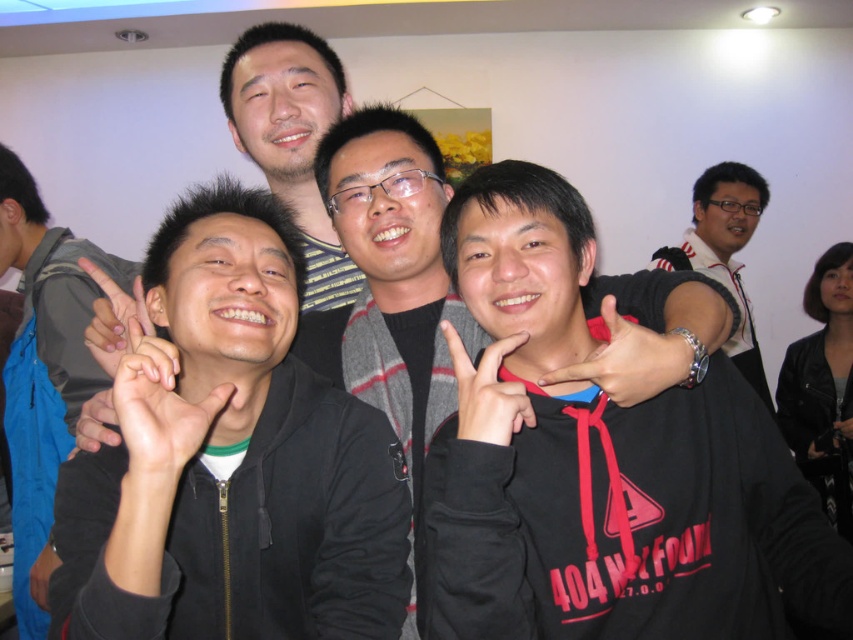
Question: Which of the following is the closest to the observer?

Choices:
 (A) (242, 440)
 (B) (4, 221)

Answer: (A)

Question: Which of the following is the closest to the observer?

Choices:
 (A) black matte hoodie at center
 (B) matte black ear at lower left
 (C) black matte hand at center

Answer: (C)

Question: Among these objects, which one is farthest from the camera?

Choices:
 (A) blue matte phone at center
 (B) black matte hand at lower left
 (C) black matte hoodie at center

Answer: (B)

Question: Does matte black ear at lower left have a greater width compared to black matte hand at lower left?

Choices:
 (A) no
 (B) yes

Answer: (B)

Question: From the image, what is the correct spatial relationship of black matte jacket at left in relation to blue matte phone at center?

Choices:
 (A) left
 (B) right

Answer: (A)

Question: Is blue matte phone at center to the left of matte black hand at lower left from the viewer's perspective?

Choices:
 (A) no
 (B) yes

Answer: (A)